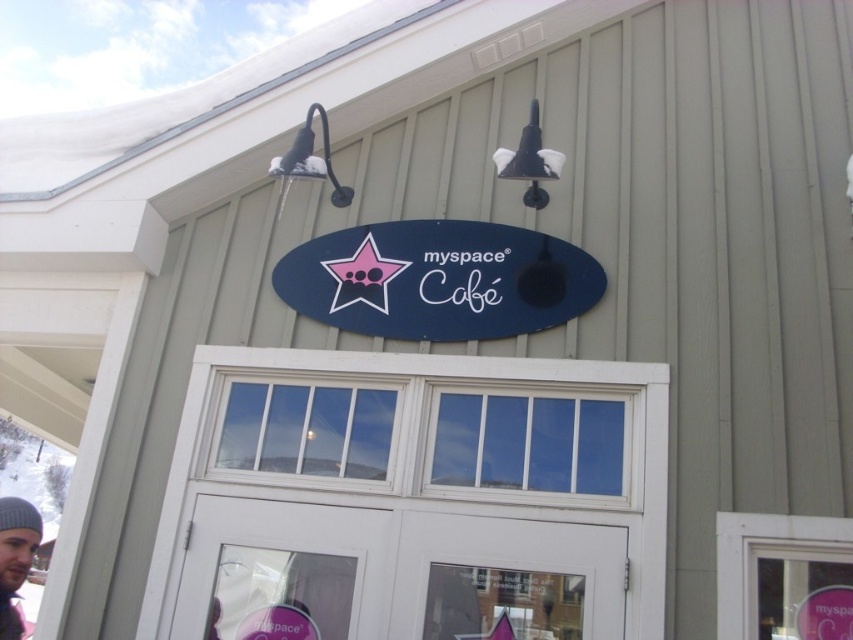
Can you confirm if white wooden door at center is smaller than matte blue sign at center?

No, white wooden door at center is not smaller than matte blue sign at center.

Find the location of a particular element. white wooden door at center is located at coordinates (413, 497).

The image size is (853, 640). What are the coordinates of `white wooden door at center` in the screenshot? It's located at (413, 497).

Who is lower down, matte blue sign at center or gray knit beanie at lower left?

gray knit beanie at lower left is below.

Which is in front, point (351, 237) or point (4, 563)?

Point (4, 563) is in front.

Where is `matte blue sign at center`? The width and height of the screenshot is (853, 640). matte blue sign at center is located at coordinates (438, 280).

In order to click on matte blue sign at center in this screenshot , I will do `click(438, 280)`.

Can you confirm if white wooden door at center is thinner than gray knit beanie at lower left?

In fact, white wooden door at center might be wider than gray knit beanie at lower left.

Find the location of a particular element. The height and width of the screenshot is (640, 853). white wooden door at center is located at coordinates (413, 497).